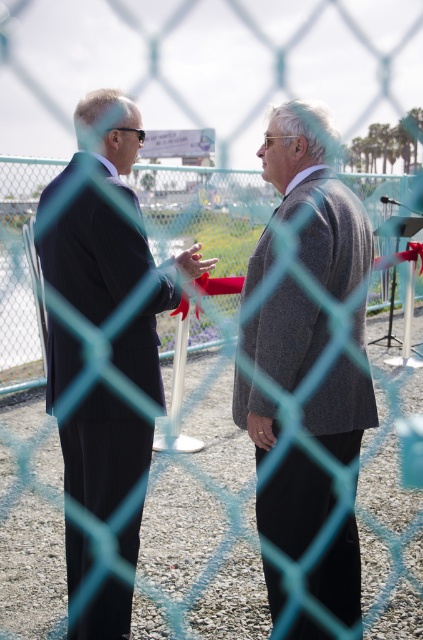
You are standing in front of a light blue chain link fence and see two men talking through it. The men are wearing a matte black suit at left and a gray wool suit at center. Which man is closer to you?

The matte black suit at left is closer to you because it is further to the viewer than the gray wool suit at center.

You are standing at the origin point of the coordinate system in the image. The fence is between you and the two men. If you want to take a photo of the matte black suit at left without the fence obstructing it, where should you move to in terms of coordinates?

To avoid the fence obstructing the matte black suit at left, you should move to coordinates near or beyond the position of the matte black suit at left, which is at point (106, 312). This would place you closer to the subject and reduce the fence interference.

You are standing behind the light blue chain link fence and want to know which man is taller based on their suits. Which one is taller, the matte black suit at left or the gray wool suit at center?

The matte black suit at left is much taller as gray wool suit at center.